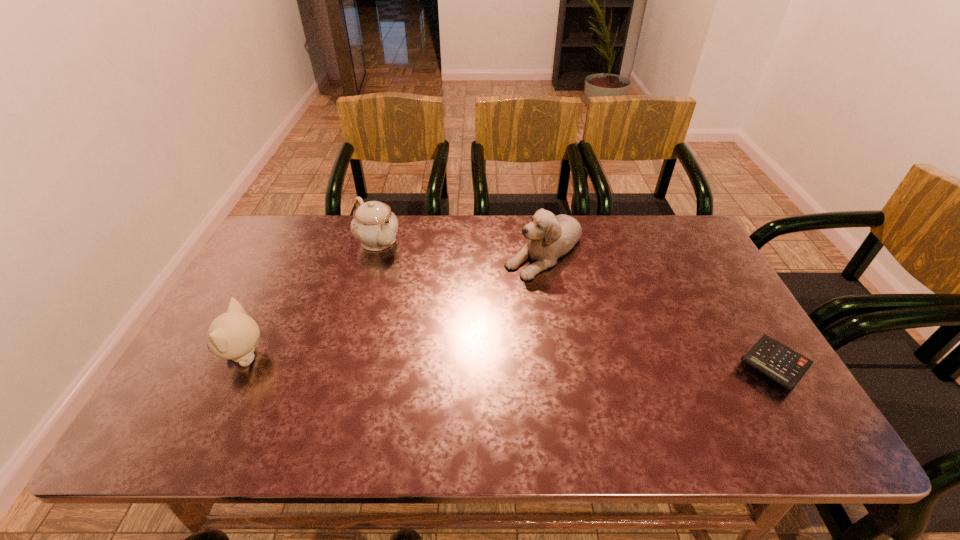
At what (x,y) coordinates should I click in order to perform the action: click on free region located 0.060m at the spout of the second object from left to right. Please return your answer as a coordinate pair (x, y). Looking at the image, I should click on (398, 264).

Where is `free spot located 0.260m at the spout of the second object from left to right`? free spot located 0.260m at the spout of the second object from left to right is located at coordinates (434, 300).

The height and width of the screenshot is (540, 960). What are the coordinates of `free location located at the spout of the second object from left to right` in the screenshot? It's located at (430, 296).

You are a GUI agent. You are given a task and a screenshot of the screen. Output one action in this format:
    pyautogui.click(x=<x>, y=<y>)
    Task: Click on the puppy that is at the far edge
    
    Given the screenshot: What is the action you would take?
    pyautogui.click(x=550, y=237)

Image resolution: width=960 pixels, height=540 pixels. I want to click on chinaware that is at the far edge, so click(374, 225).

Where is `kitten present at the near edge`? kitten present at the near edge is located at coordinates (233, 335).

Where is `calculator located at the near edge`? This screenshot has height=540, width=960. calculator located at the near edge is located at coordinates (785, 366).

The width and height of the screenshot is (960, 540). What are the coordinates of `object situated at the left edge` in the screenshot? It's located at (233, 335).

Identify the location of object that is at the right edge. This screenshot has height=540, width=960. (785, 366).

This screenshot has width=960, height=540. I want to click on object that is at the near left corner, so click(x=233, y=335).